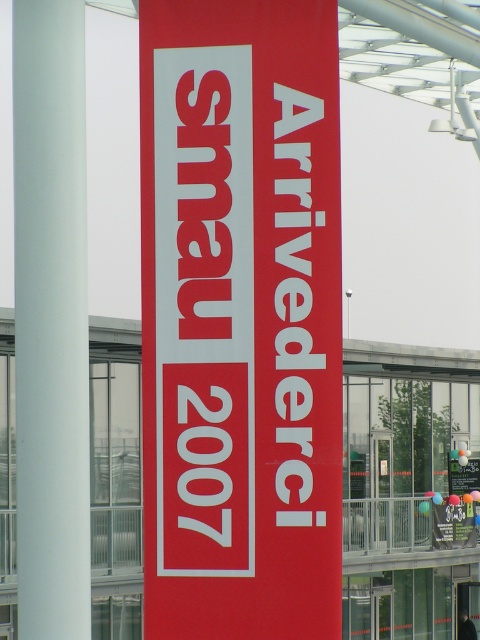
You are setting up a booth at an event and need to place the matte red banner at center and the white smooth pole at left. Given their sizes, which object should be placed closer to the entrance to ensure visibility?

The white smooth pole at left should be placed closer to the entrance because it is larger in size compared to the matte red banner at center, making it more visible from a distance.

You are standing in a convention center and see a point marked at coordinates (240,317). Based on the scene, what object is located at that point?

The point at coordinates (240,317) indicates the location of the matte red banner at center.

Based on the photo, you are an event organizer setting up for a farewell event. You have a matte red banner at center and a white smooth pole at left. Which object is narrower?

The matte red banner at center is narrower than the white smooth pole at left according to the description.